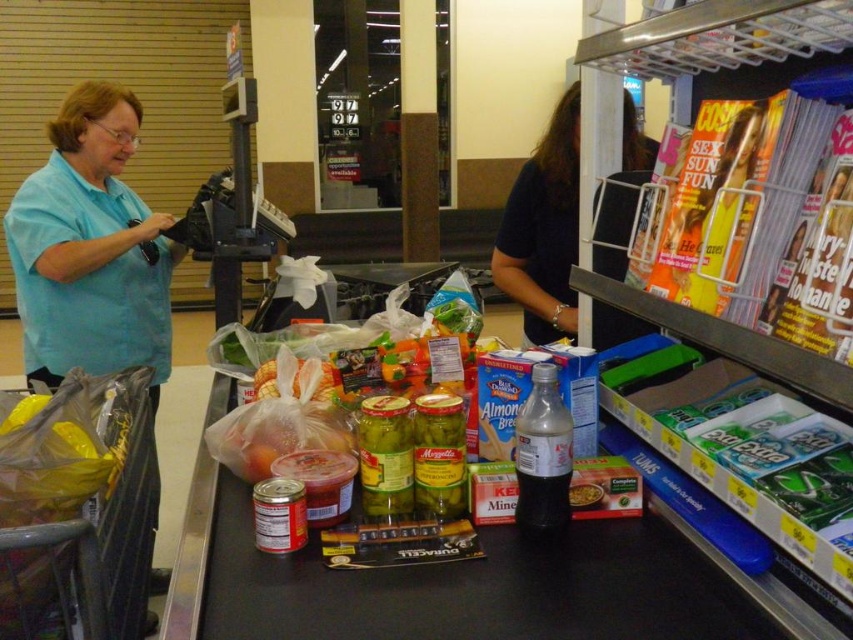
You are a customer at the grocery store and need to place your items on the conveyor belt. The light blue shirt at left is behind the counter, and the smooth plastic container at center is on the belt. Which object is wider?

The light blue shirt at left is wider than the smooth plastic container at center.